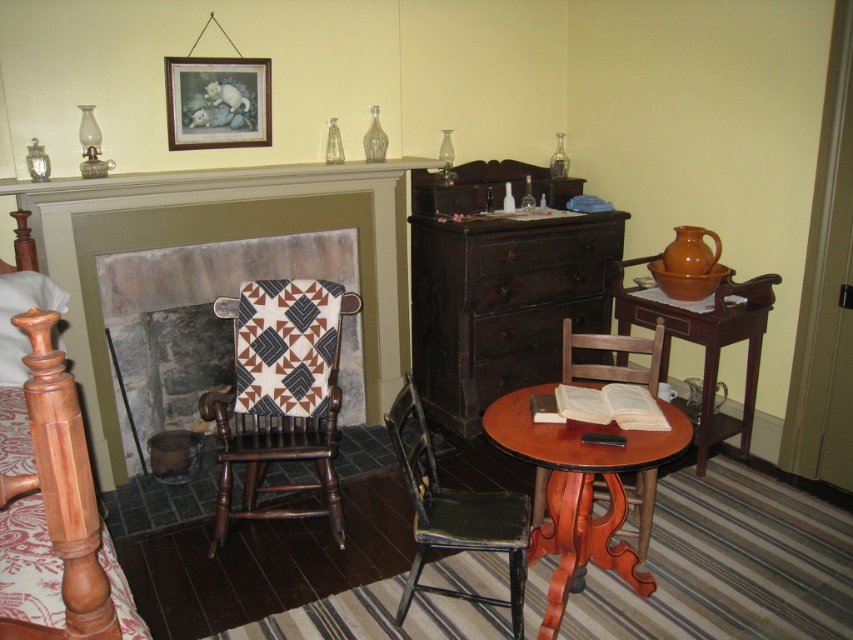
Can you confirm if stone fireplace at center is bigger than distressed green wood chair at lower center?

Indeed, stone fireplace at center has a larger size compared to distressed green wood chair at lower center.

Who is more distant from viewer, (140, 360) or (426, 444)?

Positioned behind is point (140, 360).

What do you see at coordinates (198, 310) in the screenshot?
I see `stone fireplace at center` at bounding box center [198, 310].

Where is `stone fireplace at center`? stone fireplace at center is located at coordinates (198, 310).

Does wooden bedpost at left appear under mahogany wood armchair at center?

No.

Is wooden bedpost at left wider than mahogany wood armchair at center?

Yes, wooden bedpost at left is wider than mahogany wood armchair at center.

Measure the distance between wooden bedpost at left and camera.

wooden bedpost at left is 1.11 meters from camera.

The width and height of the screenshot is (853, 640). I want to click on wooden bedpost at left, so click(x=53, y=504).

What are the coordinates of `quilted fabric rocking chair at center` in the screenshot? It's located at (280, 394).

Is quilted fabric rocking chair at center bigger than wooden picture frame at upper center?

Yes.

Who is more distant from viewer, (310, 332) or (207, 125)?

The point (207, 125) is more distant.

Identify the location of quilted fabric rocking chair at center. (280, 394).